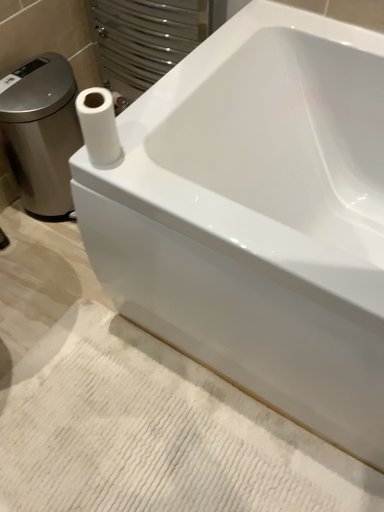
Identify the location of vacant space behind white matte paper towel at upper left. This screenshot has height=512, width=384. (152, 106).